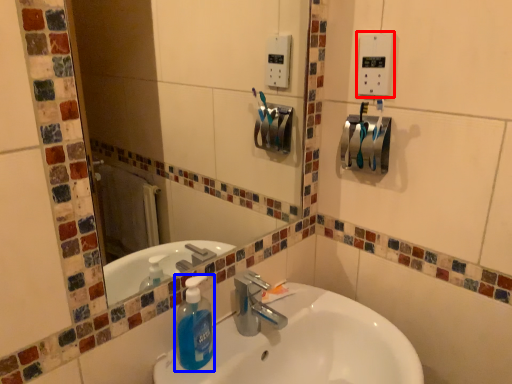
Question: Among these objects, which one is farthest to the camera, light switch (highlighted by a red box) or cleaning product (highlighted by a blue box)?

Choices:
 (A) light switch
 (B) cleaning product

Answer: (A)